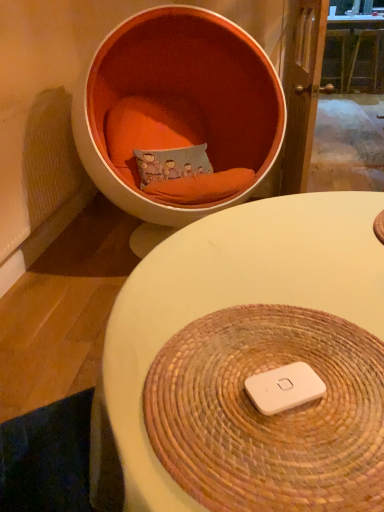
Question: From a real-world perspective, is wooden table at upper center, placed as the first table when sorted from back to front, above or below orange fabric chair at upper left?

Choices:
 (A) below
 (B) above

Answer: (A)

Question: In terms of height, does wooden table at upper center, which is the first table from right to left, look taller or shorter compared to orange fabric chair at upper left?

Choices:
 (A) short
 (B) tall

Answer: (A)

Question: Estimate the real-world distances between objects in this image. Which object is farther from the white matte/ipod at center?

Choices:
 (A) orange fabric chair at upper left
 (B) textured fabric pillow at center
 (C) wooden table at upper center, which appears as the 2th table when viewed from the front
 (D) white woven placemat at center, marked as the 1th table in a bottom-to-top arrangement

Answer: (C)

Question: Estimate the real-world distances between objects in this image. Which object is closer to the white woven placemat at center, arranged as the 1th table when viewed from the left?

Choices:
 (A) orange fabric chair at upper left
 (B) white matte/ipod at center
 (C) textured fabric pillow at center
 (D) wooden table at upper center, which appears as the 2th table when viewed from the front

Answer: (B)